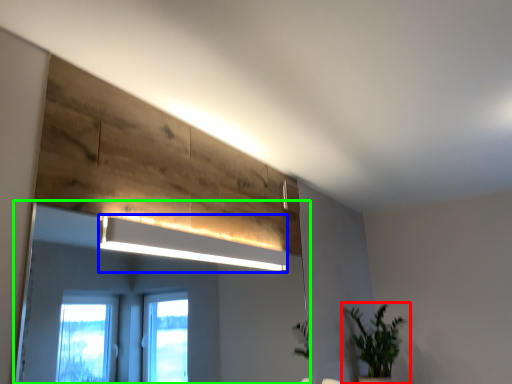
Question: Considering the real-world distances, which object is farthest from houseplant (highlighted by a red box)? lamp (highlighted by a blue box) or mirror (highlighted by a green box)?

Choices:
 (A) lamp
 (B) mirror

Answer: (B)